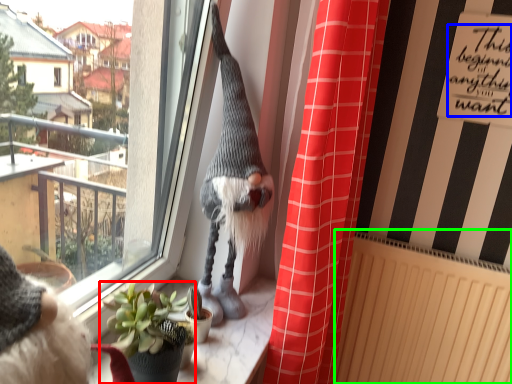
Question: Estimate the real-world distances between objects in this image. Which object is closer to houseplant (highlighted by a red box), writing (highlighted by a blue box) or radiator (highlighted by a green box)?

Choices:
 (A) writing
 (B) radiator

Answer: (B)